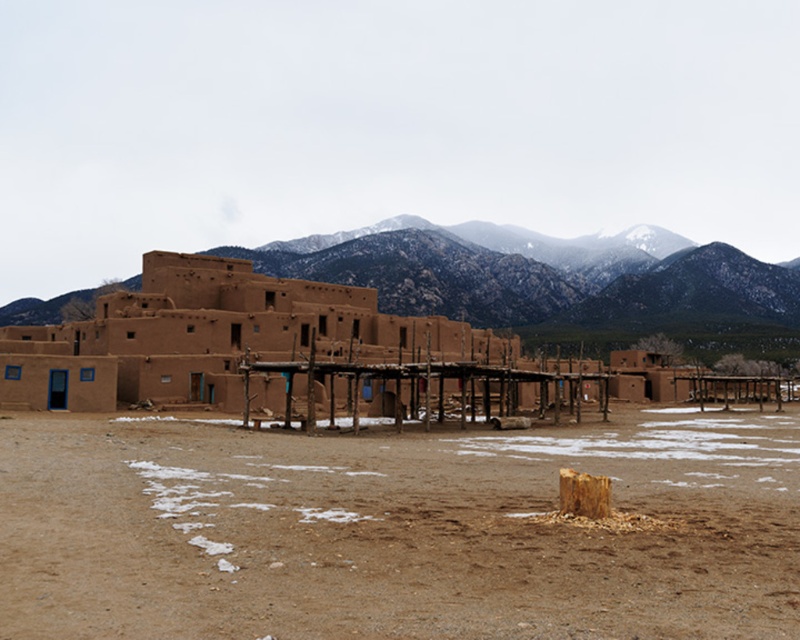
You are standing at the entrance of the traditional adobe building complex and want to place a decorative stone exactly at the center of the brown sandy dirt at center. According to the coordinates provided, where should you place the stone?

The brown sandy dirt at center is located at point (396, 531), so you should place the decorative stone at coordinates (396, 531) to mark its center.